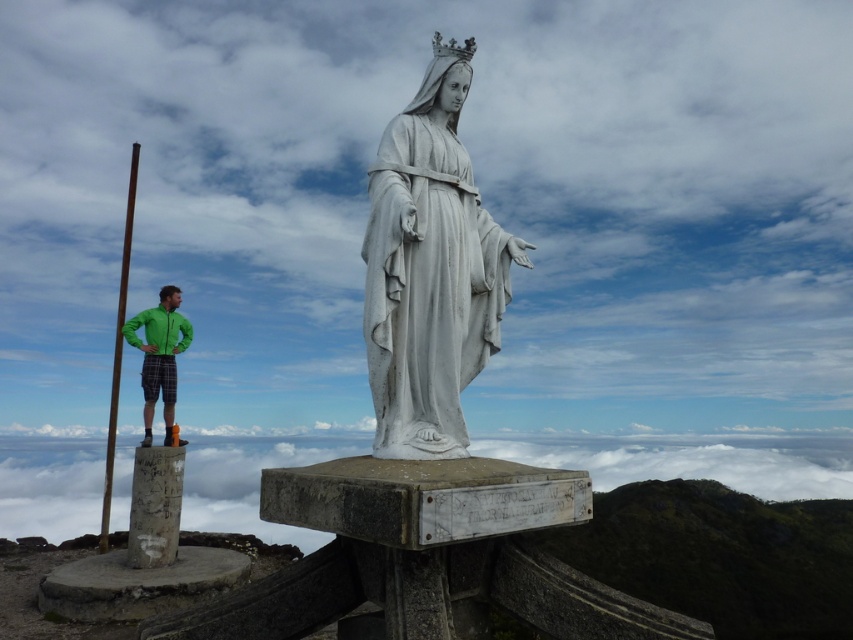
You are standing in front of the statue and want to place a small flower at one of the two points marked in the image. Which point is closer to you, point (387, 248) or point (166, 317)?

Point (387, 248) is closer to the viewer than point (166, 317), so you should place the flower at point (387, 248).

You are a photographer trying to capture the statue in the center. You have a camera with a 100mm lens. The statue is at point (430, 269). Can you focus on the statue with this lens?

The point (430, 269) indicates the white marble statue at center, so yes, the camera with a 100mm lens can focus on the statue at that point.